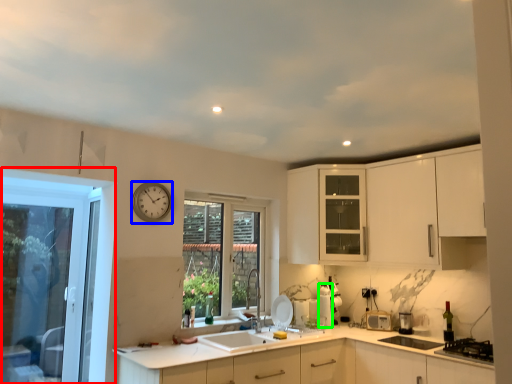
Question: Which object is positioned closest to window (highlighted by a red box)? Select from clock (highlighted by a blue box) and appliance (highlighted by a green box).

Choices:
 (A) clock
 (B) appliance

Answer: (A)